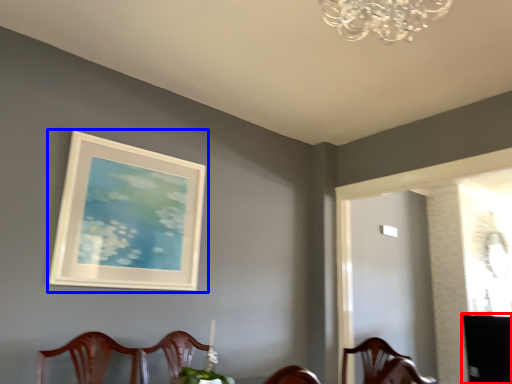
Question: Which point is closer to the camera, table (highlighted by a red box) or picture frame (highlighted by a blue box)?

Choices:
 (A) table
 (B) picture frame

Answer: (B)